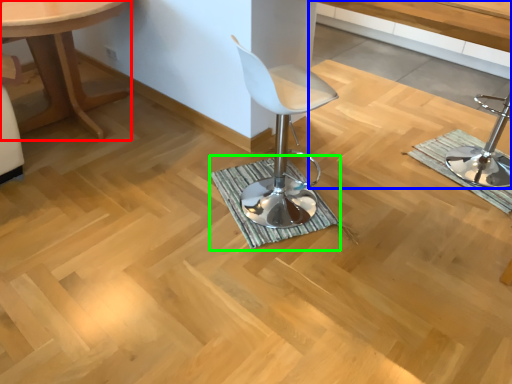
Question: Based on their relative distances, which object is nearer to table (highlighted by a red box)? Choose from vanity (highlighted by a blue box) and bath mat (highlighted by a green box).

Choices:
 (A) vanity
 (B) bath mat

Answer: (B)